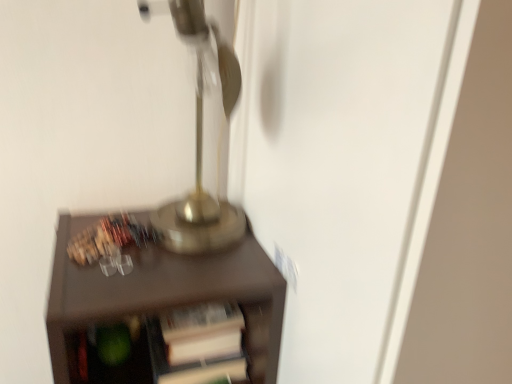
Where is `free space in front of gold metallic table lamp at upper center`? free space in front of gold metallic table lamp at upper center is located at coordinates (157, 284).